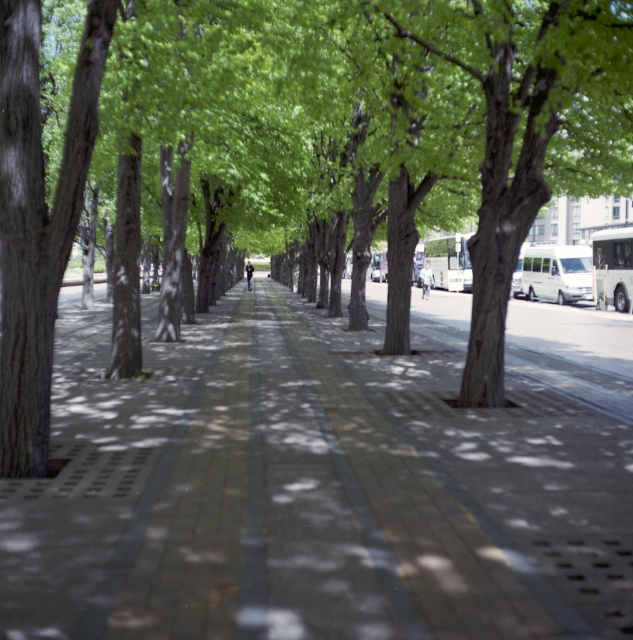
Is point (537, 460) behind point (363, 269)?

No, (537, 460) is in front of (363, 269).

Can you confirm if brick pavement at center is bigger than brown textured tree at center?

Incorrect, brick pavement at center is not larger than brown textured tree at center.

Between point (584, 492) and point (470, 8), which one is positioned behind?

The point (470, 8) is behind.

Find the location of a particular element. The height and width of the screenshot is (640, 633). brick pavement at center is located at coordinates (311, 493).